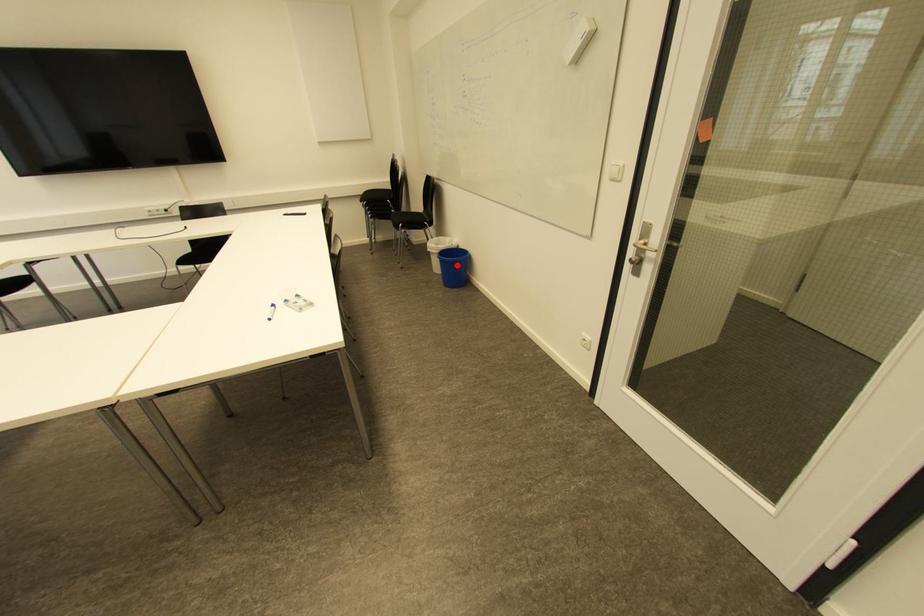
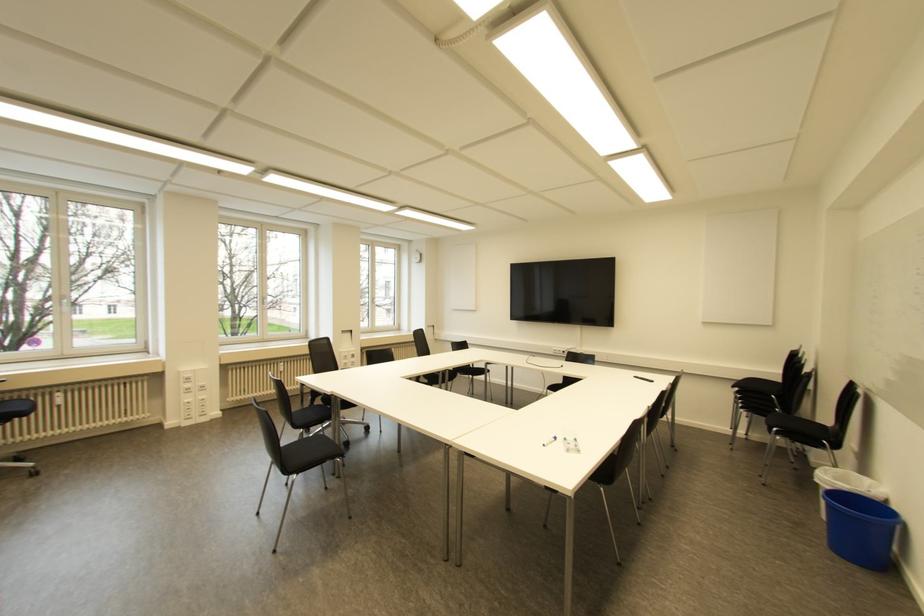
Question: I am providing you with two images of the same scene from different viewpoints. In image1, a red point is highlighted. Considering the same 3D point in image2, which of the following is correct?

Choices:
 (A) It is closer
 (B) It is farther

Answer: (B)